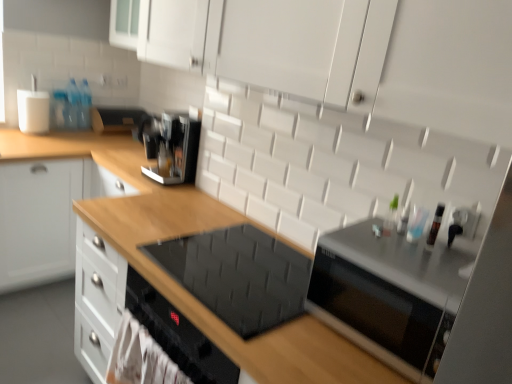
Question: Are transparent plastic bottle at upper right, positioned as the 2th bottle in left-to-right order, and clear plastic bottle at upper left, acting as the second bottle starting from the right, far apart?

Choices:
 (A) yes
 (B) no

Answer: (A)

Question: Does transparent plastic bottle at upper right, the 1th bottle from the right, lie behind clear plastic bottle at upper left, which appears as the 1th bottle when viewed from the top?

Choices:
 (A) no
 (B) yes

Answer: (A)

Question: Is transparent plastic bottle at upper right, the first bottle in the front-to-back sequence, to the right of clear plastic bottle at upper left, acting as the second bottle starting from the right, from the viewer's perspective?

Choices:
 (A) no
 (B) yes

Answer: (B)

Question: Is transparent plastic bottle at upper right, the 1th bottle from the right, taller than clear plastic bottle at upper left, the second bottle in the front-to-back sequence?

Choices:
 (A) yes
 (B) no

Answer: (B)

Question: Is transparent plastic bottle at upper right, marked as the second bottle in a back-to-front arrangement, bigger than clear plastic bottle at upper left, acting as the second bottle starting from the right?

Choices:
 (A) yes
 (B) no

Answer: (B)

Question: From the image's perspective, does transparent plastic bottle at upper right, positioned as the 2th bottle in left-to-right order, appear higher than clear plastic bottle at upper left, acting as the first bottle starting from the left?

Choices:
 (A) no
 (B) yes

Answer: (A)

Question: Is black glass cooktop at center to the left of satin black toaster at upper center, placed as the first appliance when sorted from top to bottom, from the viewer's perspective?

Choices:
 (A) yes
 (B) no

Answer: (B)

Question: From the image's perspective, is black glass cooktop at center over satin black toaster at upper center, arranged as the 1th appliance when viewed from the left?

Choices:
 (A) no
 (B) yes

Answer: (A)

Question: From the image's perspective, is black glass cooktop at center under satin black toaster at upper center, arranged as the 1th appliance when viewed from the left?

Choices:
 (A) no
 (B) yes

Answer: (B)

Question: Is black glass cooktop at center oriented away from satin black toaster at upper center, the 2th appliance from the right?

Choices:
 (A) no
 (B) yes

Answer: (A)

Question: From a real-world perspective, is black glass cooktop at center under satin black toaster at upper center, arranged as the 2th appliance when ordered from the bottom?

Choices:
 (A) yes
 (B) no

Answer: (A)

Question: From a real-world perspective, does black glass cooktop at center stand above satin black toaster at upper center, the 2th appliance when ordered from front to back?

Choices:
 (A) yes
 (B) no

Answer: (B)

Question: From the image's perspective, would you say satin black toaster at upper center, arranged as the 2th appliance when ordered from the bottom, is shown under wooden drawer at left?

Choices:
 (A) yes
 (B) no

Answer: (B)